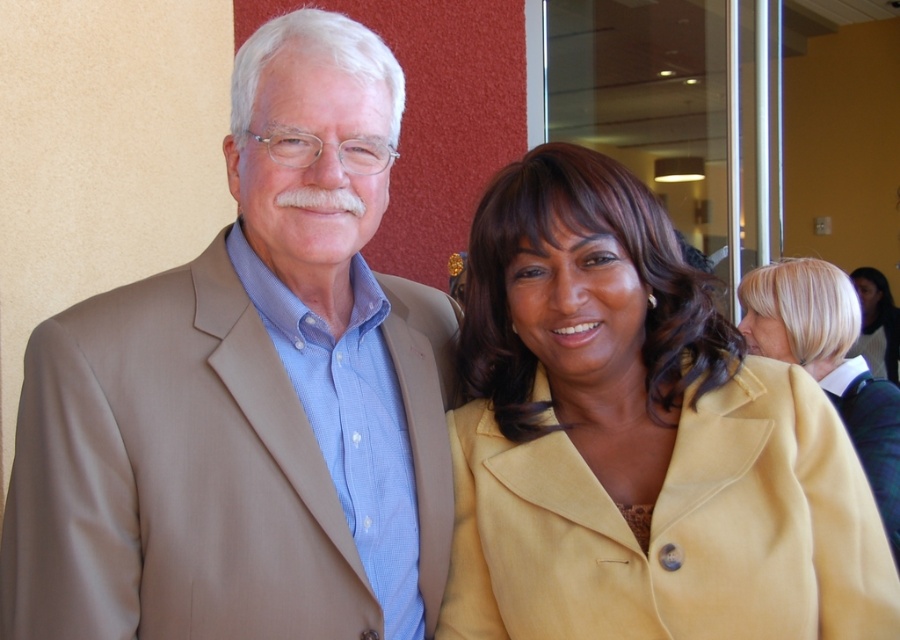
You are an interior designer assessing the color contrast in the image. The tan fabric suit at left and the yellow suede jacket at center are part of the scene. Which object has a higher position in the image?

The tan fabric suit at left has a greater height compared to the yellow suede jacket at center, so the tan fabric suit at left is positioned higher in the image.

You are organizing a charity event and need to decide which outfit to donate. The tan fabric suit at left and the matte yellow coat at center are both available. Based on their sizes, which one would be more suitable for a petite individual?

The tan fabric suit at left has a smaller size compared to the matte yellow coat at center, making it more suitable for a petite individual.

You are an interior designer assessing the layout of this office space. You need to determine if the tan fabric suit at left has a greater width than the blonde hair at upper right. Based on the scene provided, can you confirm this?

The tan fabric suit at left has a greater width than the blonde hair at upper right according to the description provided.